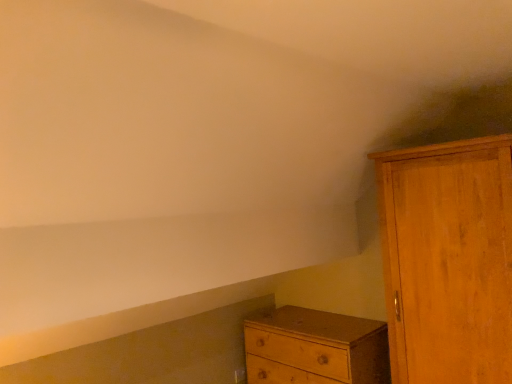
Question: Considering the relative sizes of wooden cupboard at right and wooden chest of drawers at lower center in the image provided, is wooden cupboard at right thinner than wooden chest of drawers at lower center?

Choices:
 (A) no
 (B) yes

Answer: (A)

Question: Is wooden cupboard at right behind wooden chest of drawers at lower center?

Choices:
 (A) yes
 (B) no

Answer: (B)

Question: Does wooden cupboard at right have a larger size compared to wooden chest of drawers at lower center?

Choices:
 (A) no
 (B) yes

Answer: (B)

Question: Could you tell me if wooden cupboard at right is facing wooden chest of drawers at lower center?

Choices:
 (A) no
 (B) yes

Answer: (A)

Question: Considering the relative positions of wooden cupboard at right and wooden chest of drawers at lower center in the image provided, is wooden cupboard at right to the right of wooden chest of drawers at lower center from the viewer's perspective?

Choices:
 (A) no
 (B) yes

Answer: (B)

Question: Considering the relative positions of wooden cupboard at right and wooden chest of drawers at lower center in the image provided, is wooden cupboard at right in front of wooden chest of drawers at lower center?

Choices:
 (A) no
 (B) yes

Answer: (B)

Question: Is wooden chest of drawers at lower center thinner than wooden cupboard at right?

Choices:
 (A) yes
 (B) no

Answer: (A)

Question: Is wooden chest of drawers at lower center not within wooden cupboard at right?

Choices:
 (A) no
 (B) yes

Answer: (B)

Question: From the image's perspective, is wooden chest of drawers at lower center on wooden cupboard at right?

Choices:
 (A) yes
 (B) no

Answer: (B)

Question: Is wooden chest of drawers at lower center facing towards wooden cupboard at right?

Choices:
 (A) no
 (B) yes

Answer: (A)

Question: Is wooden chest of drawers at lower center positioned far away from wooden cupboard at right?

Choices:
 (A) no
 (B) yes

Answer: (A)

Question: From a real-world perspective, is wooden chest of drawers at lower center physically below wooden cupboard at right?

Choices:
 (A) no
 (B) yes

Answer: (B)

Question: Considering the positions of wooden chest of drawers at lower center and wooden cupboard at right in the image, is wooden chest of drawers at lower center taller or shorter than wooden cupboard at right?

Choices:
 (A) short
 (B) tall

Answer: (A)